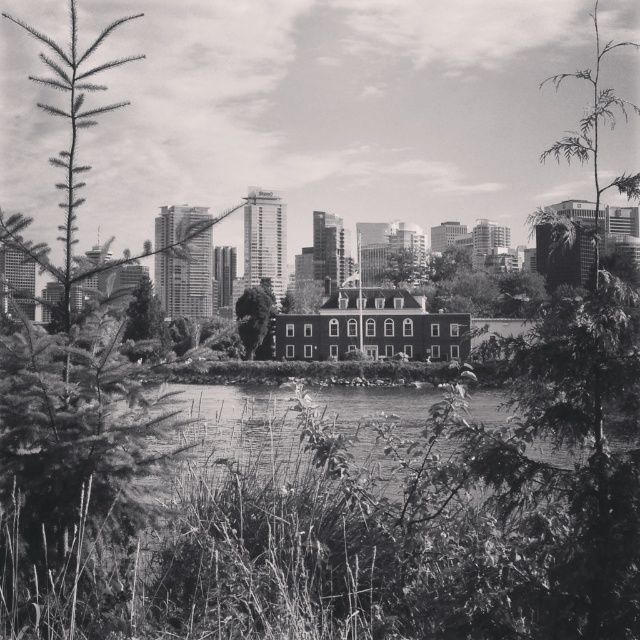
Image resolution: width=640 pixels, height=640 pixels. What do you see at coordinates (256, 320) in the screenshot?
I see `smooth green tree at center` at bounding box center [256, 320].

Is point (266, 304) closer to camera compared to point (401, 269)?

Yes, it is in front of point (401, 269).

The image size is (640, 640). I want to click on smooth green tree at center, so click(256, 320).